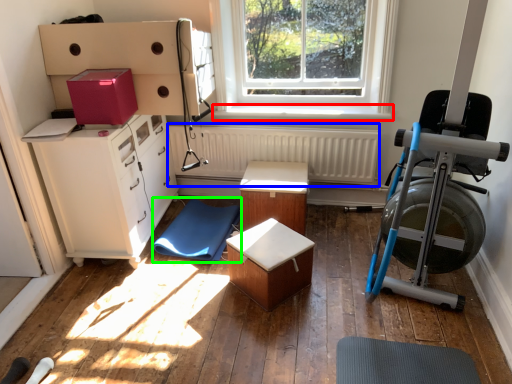
Question: Which object is the closest to the window sill (highlighted by a red box)? Choose among these: radiator (highlighted by a blue box) or yoga mat (highlighted by a green box).

Choices:
 (A) radiator
 (B) yoga mat

Answer: (A)